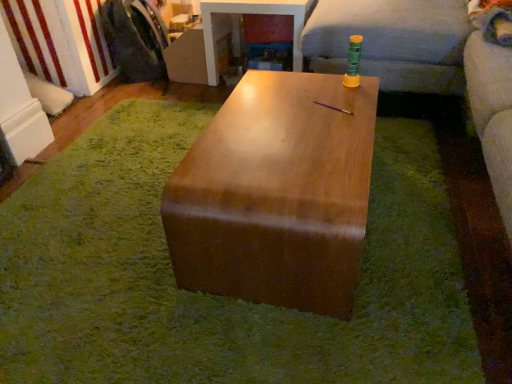
Image resolution: width=512 pixels, height=384 pixels. Find the location of `vacant point above wooden table at center (from a real-world perspective)`. vacant point above wooden table at center (from a real-world perspective) is located at coordinates (152, 218).